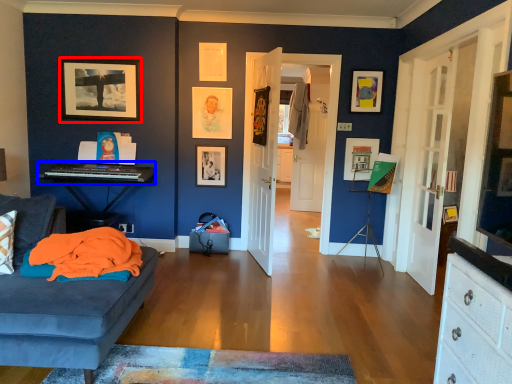
Question: Which of the following is the closest to the observer, picture frame (highlighted by a red box) or musical keyboard (highlighted by a blue box)?

Choices:
 (A) picture frame
 (B) musical keyboard

Answer: (B)